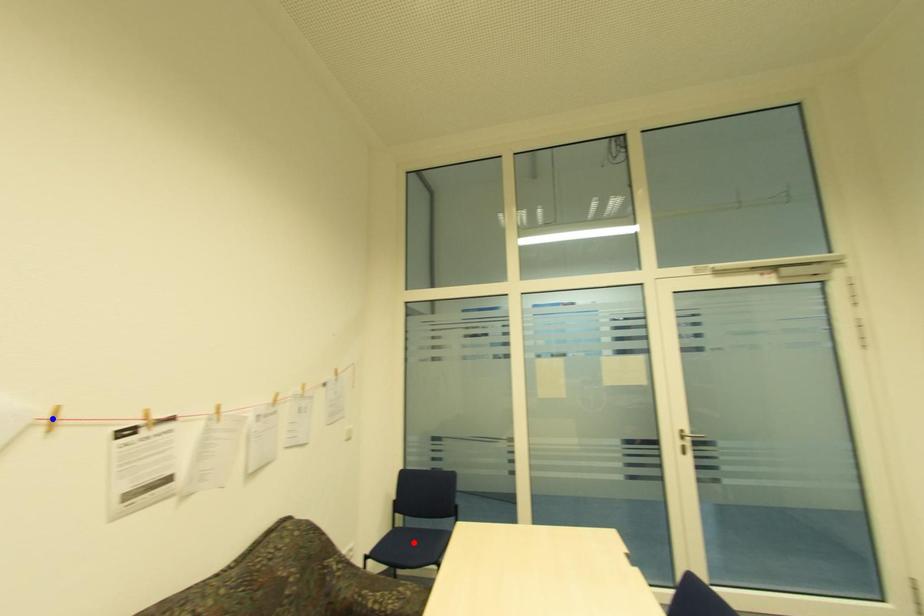
Question: Two points are marked on the image. Which point is closer to the camera?

Choices:
 (A) Blue point is closer.
 (B) Red point is closer.

Answer: (A)